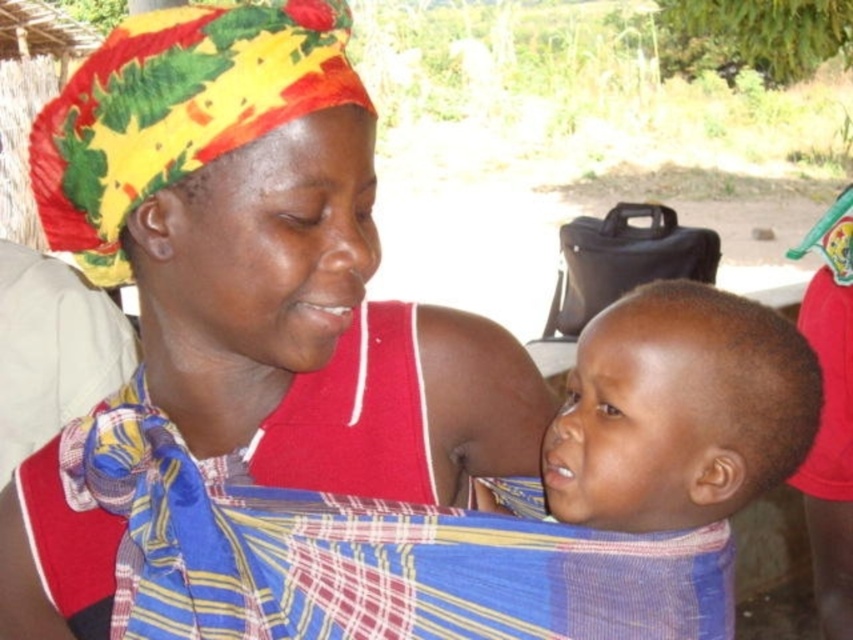
You are a photographer trying to capture a closeup of the matte red tank top at center and the smooth fabric baby at center in the image. The camera you are using has a maximum focus range of 5 inches. Can you focus on both objects simultaneously?

The matte red tank top at center and smooth fabric baby at center are 4.85 inches apart, so yes, the camera can focus on both objects simultaneously since they are within the 5 inch focus range.

From the picture: Where is the matte red tank top at center located in the image?

The matte red tank top at center is located at point [271,259].

You are a fashion designer observing the scene. You need to determine if the matte red tank top at center can be worn under a jacket without covering the smooth fabric baby at center. Can it?

The matte red tank top at center is larger in size than the smooth fabric baby at center. Since the tank top is bigger, it can likely be worn under a jacket without covering the baby as long as the jacket is appropriately sized and positioned.